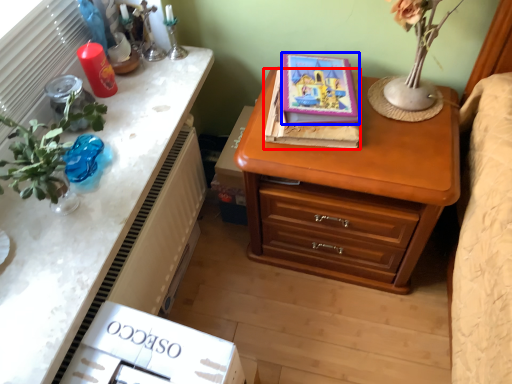
Question: Among these objects, which one is nearest to the camera, book (highlighted by a red box) or book (highlighted by a blue box)?

Choices:
 (A) book
 (B) book

Answer: (B)